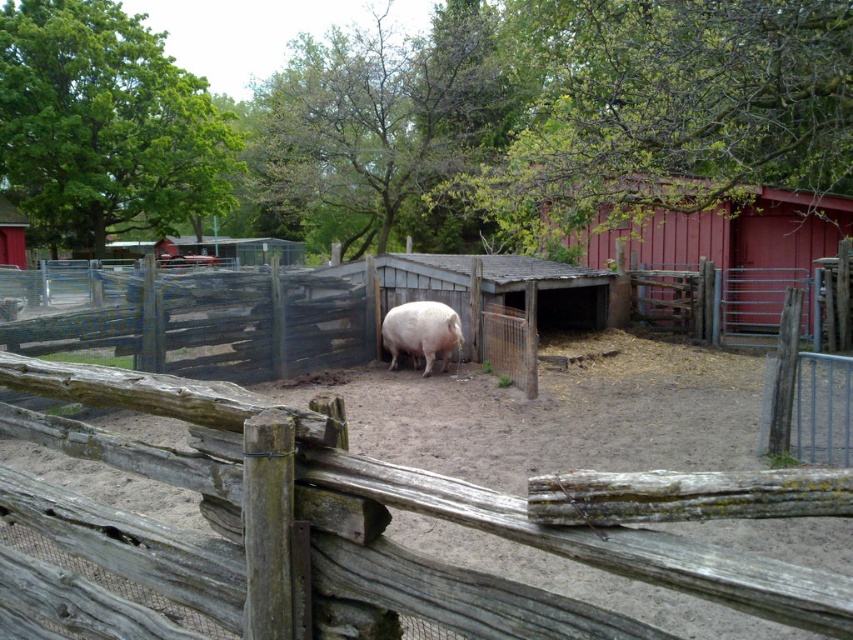
You are a farmer who wants to hang a sign on the wooden fence at left and the smooth wooden barn at center right. Which structure will require you to climb higher to hang the sign?

The smooth wooden barn at center right is taller than the wooden fence at left, so you will need to climb higher to hang the sign on the smooth wooden barn at center right.

You are a farmer checking the fence conditions on your farm. You have two sections of fence to inspect, the wooden fence at left and the weathered wood fence at center. Based on their appearance, which section might require more immediate attention due to potential structural weaknesses?

The weathered wood fence at center might require more immediate attention because it shows signs of wear and age, such as exposure to the elements, discoloration, and possible structural weaknesses compared to the wooden fence at left which might be wider and potentially more robust.

You are standing in the middle of the farm and want to locate the wooden fence at left. Which direction should you face to see it?

The wooden fence at left is located at point (213,323), so you should face to the left direction to see it.